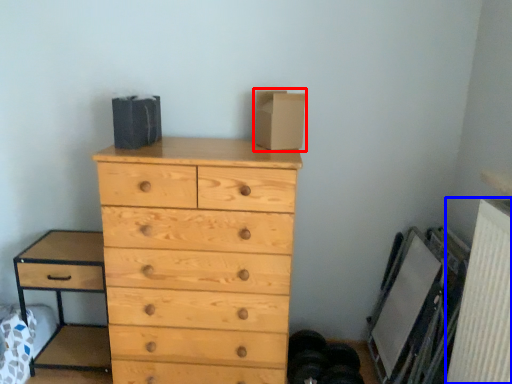
Question: Among these objects, which one is farthest to the camera, cardboard box (highlighted by a red box) or radiator (highlighted by a blue box)?

Choices:
 (A) cardboard box
 (B) radiator

Answer: (A)